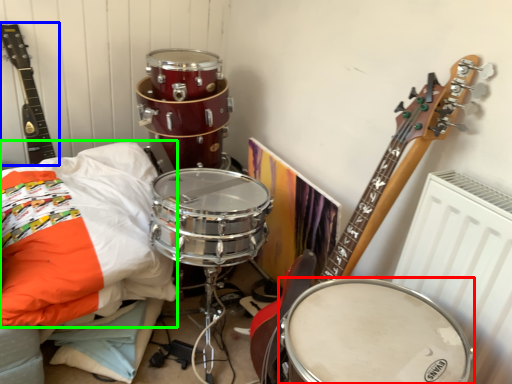
Question: Estimate the real-world distances between objects in this image. Which object is closer to drum (highlighted by a red box), guitar (highlighted by a blue box) or pillow (highlighted by a green box)?

Choices:
 (A) guitar
 (B) pillow

Answer: (B)